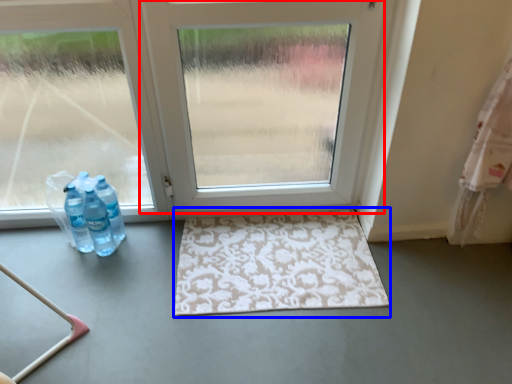
Question: Which object is further to the camera taking this photo, door (highlighted by a red box) or bath mat (highlighted by a blue box)?

Choices:
 (A) door
 (B) bath mat

Answer: (B)